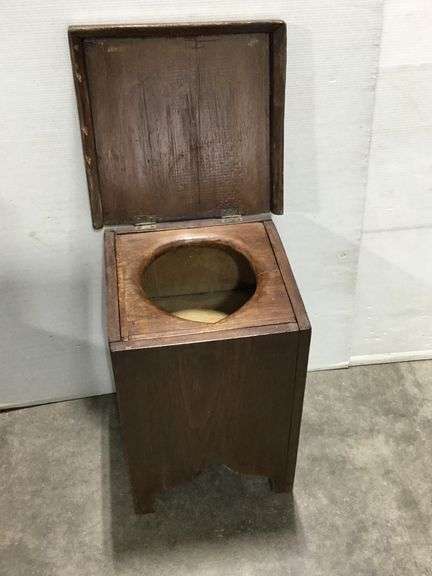
You are a GUI agent. You are given a task and a screenshot of the screen. Output one action in this format:
    pyautogui.click(x=<x>, y=<y>)
    Task: Click on the chair
    Image resolution: width=432 pixels, height=576 pixels.
    Given the screenshot: What is the action you would take?
    pyautogui.click(x=169, y=287)